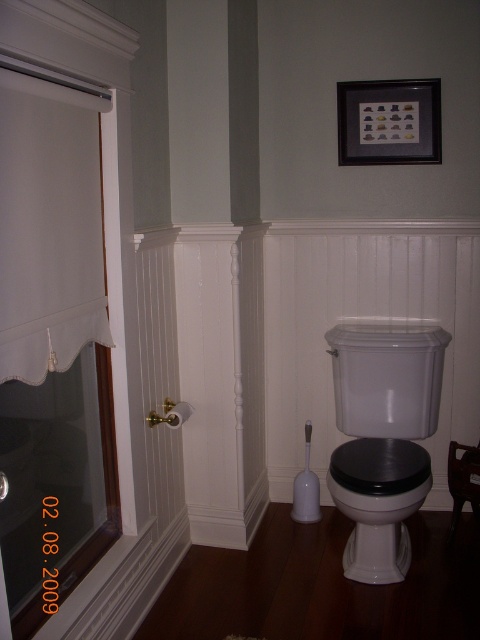
Which is below, white fabric curtain at left or white glossy toilet at lower right?

white glossy toilet at lower right is below.

Can you confirm if white fabric curtain at left is wider than white glossy toilet at lower right?

In fact, white fabric curtain at left might be narrower than white glossy toilet at lower right.

In the scene shown: Who is more distant from viewer, (99, 106) or (408, 534)?

Point (408, 534)

Locate an element on the screen. The width and height of the screenshot is (480, 640). white fabric curtain at left is located at coordinates (48, 227).

Which is behind, point (40, 250) or point (369, 362)?

Positioned behind is point (369, 362).

Based on the photo, measure the distance between point (38, 378) and camera.

They are 1.57 meters apart.

Who is more forward, (27,244) or (383,472)?

Positioned in front is point (27,244).

You are a GUI agent. You are given a task and a screenshot of the screen. Output one action in this format:
    pyautogui.click(x=<x>, y=<y>)
    Task: Click on the white fabric curtain at left
    The height and width of the screenshot is (640, 480).
    Given the screenshot: What is the action you would take?
    pyautogui.click(x=48, y=227)

How distant is white glossy toilet at center from white glossy toilet at lower right?

white glossy toilet at center is 7.93 centimeters from white glossy toilet at lower right.

Does white glossy toilet at center have a smaller size compared to white glossy toilet at lower right?

Actually, white glossy toilet at center might be larger than white glossy toilet at lower right.

Identify the location of white glossy toilet at center. The image size is (480, 640). (383, 436).